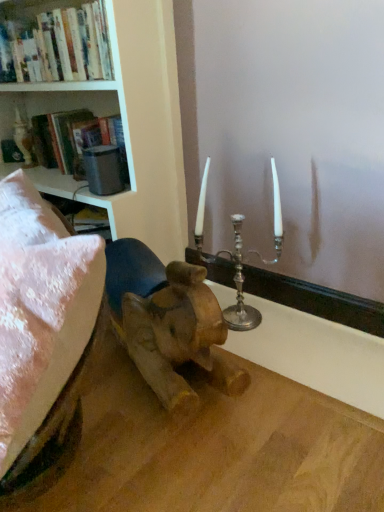
Where is `free point above silver metallic candlestick at upper center (from a real-world perspective)`? This screenshot has height=512, width=384. free point above silver metallic candlestick at upper center (from a real-world perspective) is located at coordinates (296, 275).